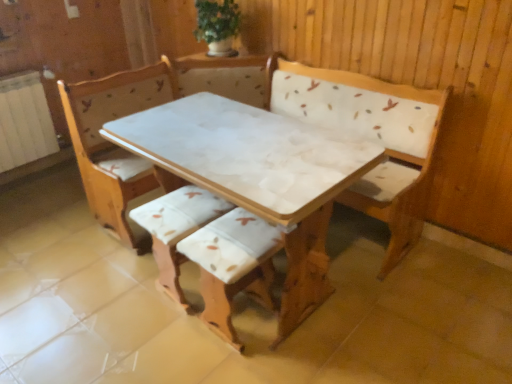
Question: Looking at the image, does white marble table at center seem bigger or smaller compared to white fabric cushion at center, which is the 2th armchair from right to left?

Choices:
 (A) big
 (B) small

Answer: (A)

Question: From a real-world perspective, relative to white fabric cushion at center, which is the first armchair in left-to-right order, is white marble table at center vertically above or below?

Choices:
 (A) below
 (B) above

Answer: (B)

Question: Estimate the real-world distances between objects in this image. Which object is farther from the white fabric cushion at center, which is the 2th armchair from right to left?

Choices:
 (A) green leafy plant at upper center
 (B) wooden armchair at center, which is the first armchair in right-to-left order
 (C) white marble table at center

Answer: (A)

Question: Which is nearer to the white fabric cushion at center, which is the 2th armchair from right to left?

Choices:
 (A) white marble table at center
 (B) wooden armchair at center, which is the first armchair in right-to-left order
 (C) green leafy plant at upper center

Answer: (B)